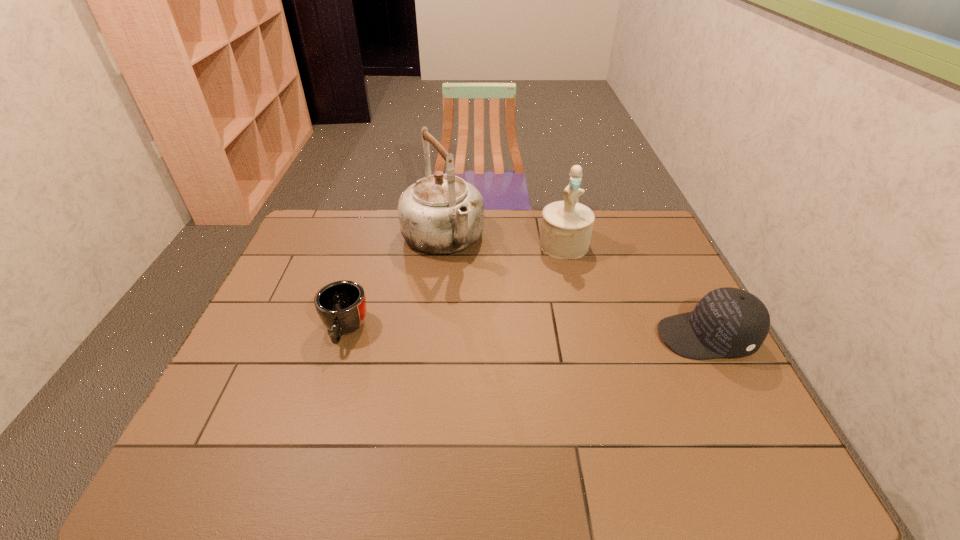
At what (x,y) coordinates should I click in order to perform the action: click on empty space that is in between the second shortest object and the second object from left to right. Please return your answer as a coordinate pair (x, y). The width and height of the screenshot is (960, 540). Looking at the image, I should click on (574, 288).

This screenshot has width=960, height=540. In order to click on empty space between the tallest object and the mug in this screenshot , I will do `click(394, 284)`.

The image size is (960, 540). Identify the location of vacant area that lies between the tallest object and the baseball cap. (574, 288).

Locate an element on the screen. The height and width of the screenshot is (540, 960). free spot between the baseball cap and the second object from right to left is located at coordinates (635, 291).

This screenshot has height=540, width=960. I want to click on free spot between the second object from left to right and the figurine, so click(x=503, y=241).

Locate an element on the screen. This screenshot has width=960, height=540. vacant space in between the baseball cap and the mug is located at coordinates (525, 333).

You are a GUI agent. You are given a task and a screenshot of the screen. Output one action in this format:
    pyautogui.click(x=<x>, y=<y>)
    Task: Click on the vacant region between the shortest object and the third object from left to right
    
    Given the screenshot: What is the action you would take?
    pyautogui.click(x=454, y=287)

The height and width of the screenshot is (540, 960). I want to click on object that stands as the second closest to the kettle, so click(566, 228).

The height and width of the screenshot is (540, 960). Identify the location of the third closest object to the tallest object. (727, 322).

You are a GUI agent. You are given a task and a screenshot of the screen. Output one action in this format:
    pyautogui.click(x=<x>, y=<y>)
    Task: Click on the free space that satisfies the following two spatial constraints: 1. on the front side of the kettle; 2. on the left side of the third object from left to right
    This screenshot has width=960, height=540.
    Given the screenshot: What is the action you would take?
    pyautogui.click(x=442, y=244)